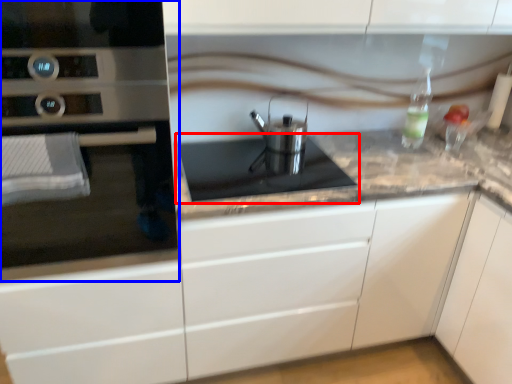
Question: Which object appears farthest to the camera in this image, gas stove (highlighted by a red box) or home appliance (highlighted by a blue box)?

Choices:
 (A) gas stove
 (B) home appliance

Answer: (A)